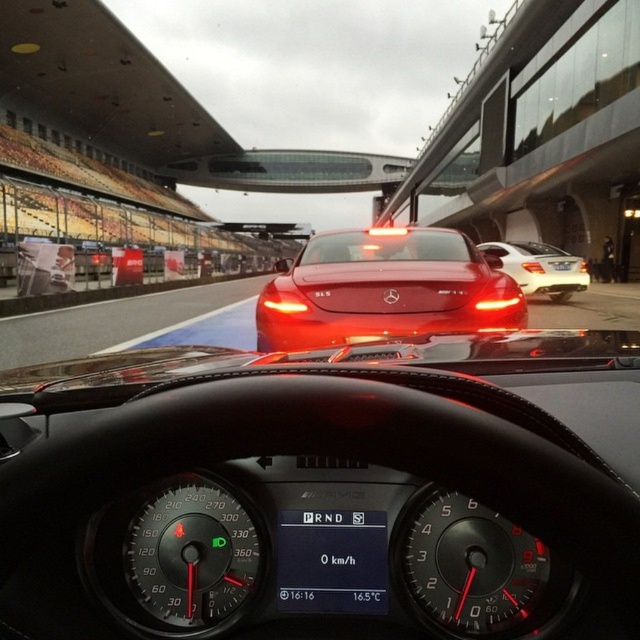
You are driving a car and want to check the license plate of the vehicle in front of you. Which object is smaller in size between the white plastic license plate at center and the white glossy sedan at center?

The white plastic license plate at center is smaller than the white glossy sedan at center.

You are a race car driver preparing for a race. You notice the shiny red car at center and the smooth asphalt race track at center. Which object is positioned to the right of the other?

The shiny red car at center is positioned to the right of the smooth asphalt race track at center.